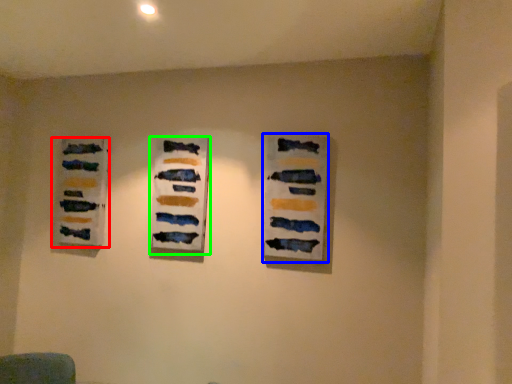
Question: Which is nearer to the art exhibition (highlighted by a red box)? art exhibition (highlighted by a blue box) or art exhibition (highlighted by a green box).

Choices:
 (A) art exhibition
 (B) art exhibition

Answer: (B)